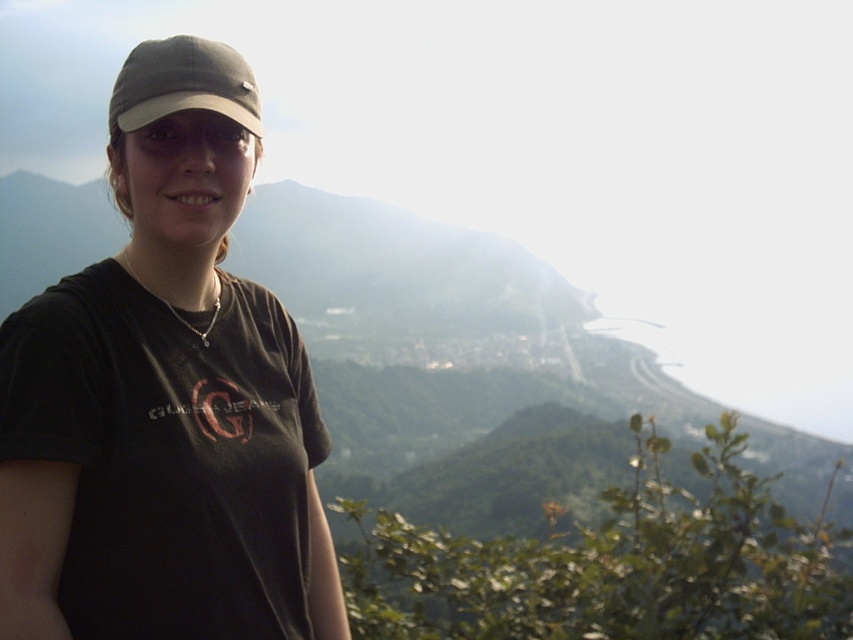
You are a photographer trying to capture a landscape photo. You have two points marked on your camera screen at coordinates point (x=59, y=628) and point (x=109, y=136). Which point is closer to the camera lens?

Point (x=59, y=628) is in front of point (x=109, y=136), so it is closer to the camera lens.

You are a photographer trying to capture a closeup shot of the black matte cap at upper left and the matte gray cap at center. Your camera has a maximum focus range of 1 meter. Can you focus on both caps at the same time?

The black matte cap at upper left is 1.11 meters away from the matte gray cap at center. Since the distance between them exceeds the camera maximum focus range of 1 meter, you cannot focus on both at the same time.

You are a photographer adjusting your camera settings to capture the person in the scene. You notice the black matte cap at upper left is positioned at point (165, 397). If you want to focus on the cap, which direction should you adjust the camera to aim? Remember to consider the coordinate system where the top left corner is 0,0 and the bottom right is 1,1.

The black matte cap at upper left is located at point (165, 397). Since the coordinate system starts at the top left corner as 0,0 and increases towards the bottom right, to focus on the cap, you should adjust the camera to aim slightly to the right and downward from the current position.